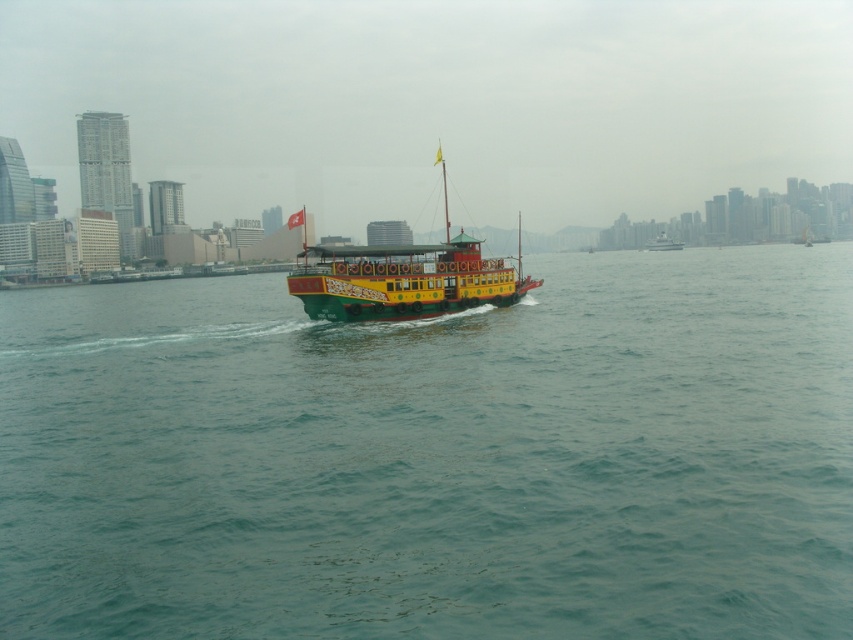
Which is behind, point (363, 253) or point (662, 244)?

Point (662, 244)

This screenshot has height=640, width=853. Find the location of `yellow-green painted wooden boat at center`. yellow-green painted wooden boat at center is located at coordinates (404, 276).

I want to click on yellow-green painted wooden boat at center, so click(404, 276).

In the scene shown: Who is positioned more to the left, green water at center or yellow-green painted wooden boat at center?

green water at center

Can you confirm if green water at center is positioned to the right of yellow-green painted wooden boat at center?

No, green water at center is not to the right of yellow-green painted wooden boat at center.

Where is `green water at center`? green water at center is located at coordinates (436, 458).

The image size is (853, 640). Identify the location of green water at center. (436, 458).

Between green water at center and yellow-green painted ferry at center, which one has more height?

yellow-green painted ferry at center

Between green water at center and yellow-green painted ferry at center, which one appears on the left side from the viewer's perspective?

From the viewer's perspective, green water at center appears more on the left side.

Does point (421, 627) lie in front of point (653, 248)?

Yes.

You are a GUI agent. You are given a task and a screenshot of the screen. Output one action in this format:
    pyautogui.click(x=<x>, y=<y>)
    Task: Click on the green water at center
    The height and width of the screenshot is (640, 853).
    Given the screenshot: What is the action you would take?
    pyautogui.click(x=436, y=458)